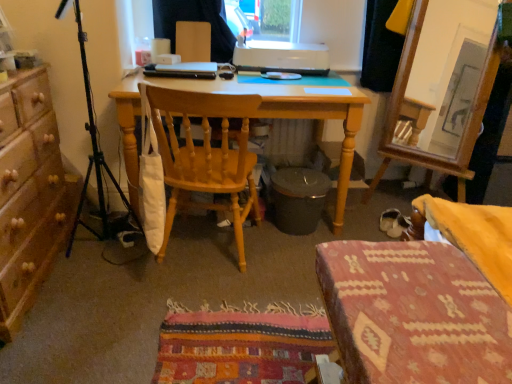
The height and width of the screenshot is (384, 512). In order to click on vacant point above black matte laptop at center (from a real-world perspective) in this screenshot , I will do `click(180, 66)`.